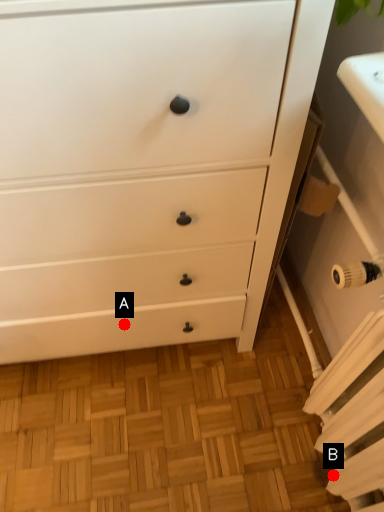
Question: Two points are circled on the image, labeled by A and B beside each circle. Which point appears closest to the camera in this image?

Choices:
 (A) A is closer
 (B) B is closer

Answer: (B)